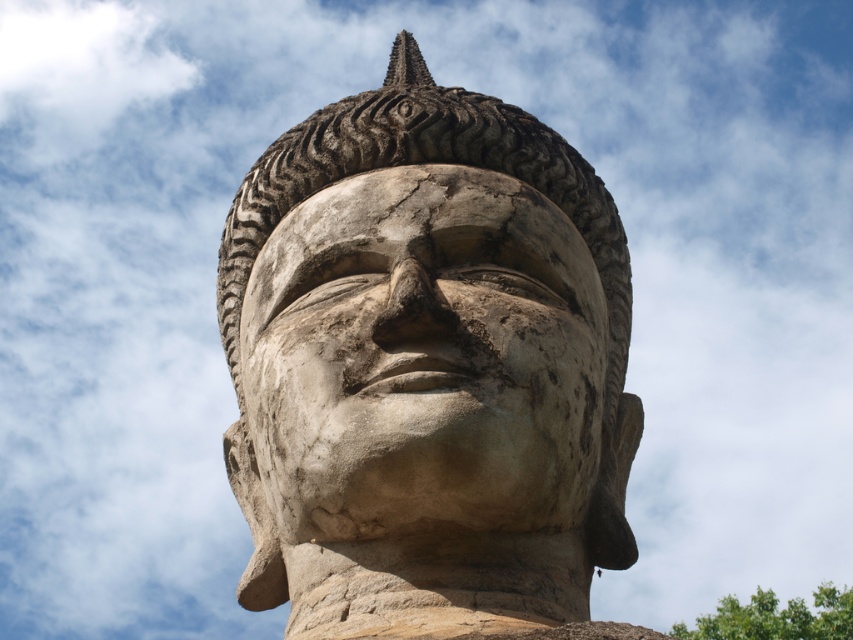
Question: Does stone statue at center have a larger size compared to weathered stone face at center?

Choices:
 (A) no
 (B) yes

Answer: (B)

Question: Is stone statue at center bigger than weathered stone face at center?

Choices:
 (A) yes
 (B) no

Answer: (A)

Question: Does stone statue at center have a lesser width compared to weathered stone face at center?

Choices:
 (A) no
 (B) yes

Answer: (A)

Question: Which point is closer to the camera?

Choices:
 (A) (537, 289)
 (B) (596, 408)

Answer: (B)

Question: Which point is farther to the camera?

Choices:
 (A) stone statue at center
 (B) weathered stone face at center

Answer: (B)